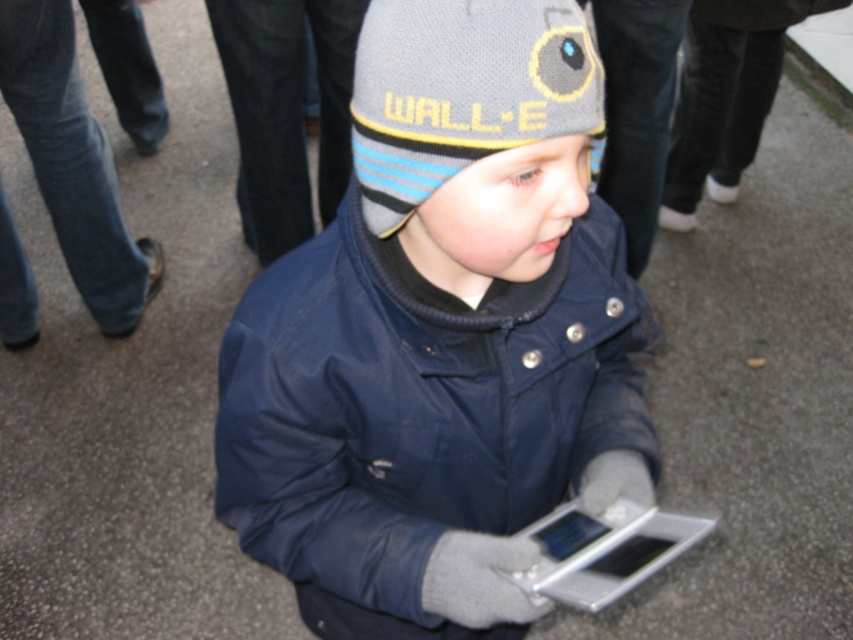
Question: Which point is closer to the camera taking this photo?

Choices:
 (A) (381, 188)
 (B) (401, 54)

Answer: (B)

Question: Which of the following is the farthest from the observer?

Choices:
 (A) (584, 304)
 (B) (503, 28)

Answer: (A)

Question: Can you confirm if matte blue jacket at center is smaller than gray knitted hat at center?

Choices:
 (A) yes
 (B) no

Answer: (B)

Question: Can you confirm if matte blue jacket at center is positioned above gray knitted hat at center?

Choices:
 (A) yes
 (B) no

Answer: (B)

Question: Does matte blue jacket at center appear on the left side of gray knitted hat at center?

Choices:
 (A) yes
 (B) no

Answer: (B)